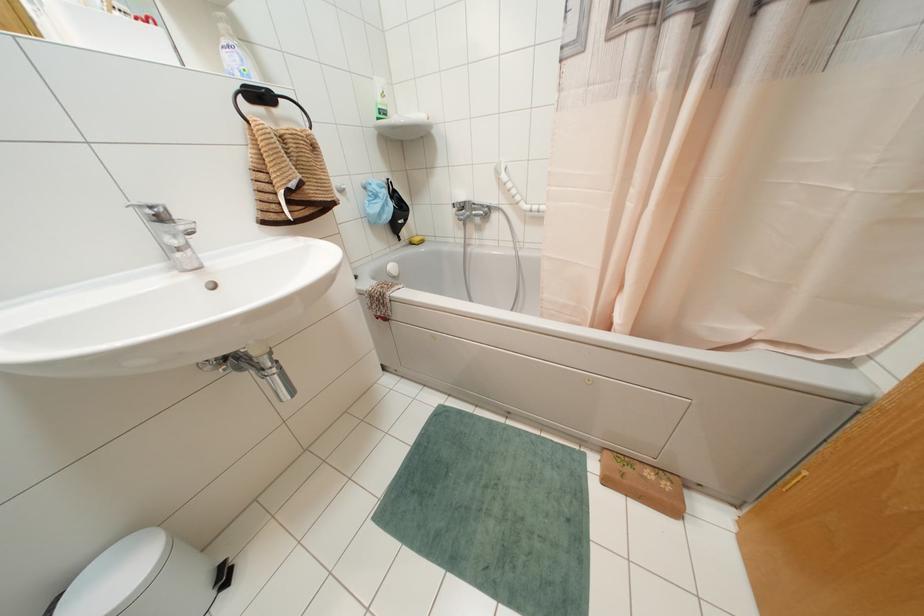
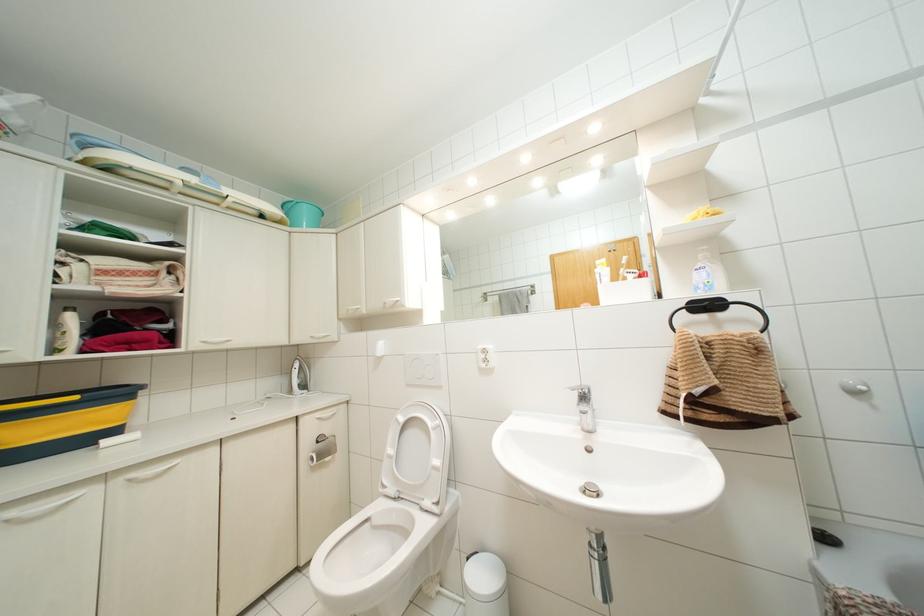
Where in the second image is the point corresponding to [236,57] from the first image?

(703, 274)